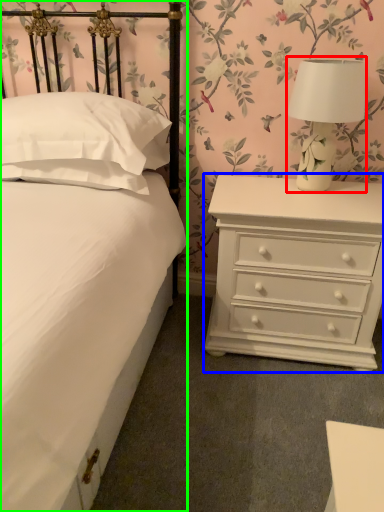
Question: Estimate the real-world distances between objects in this image. Which object is closer to table lamp (highlighted by a red box), chest of drawers (highlighted by a blue box) or bed (highlighted by a green box)?

Choices:
 (A) chest of drawers
 (B) bed

Answer: (A)